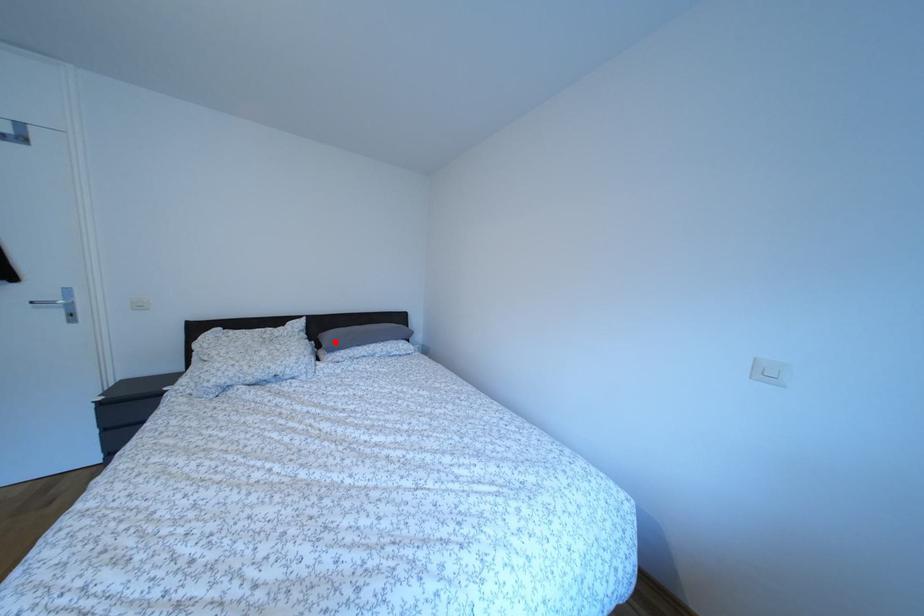
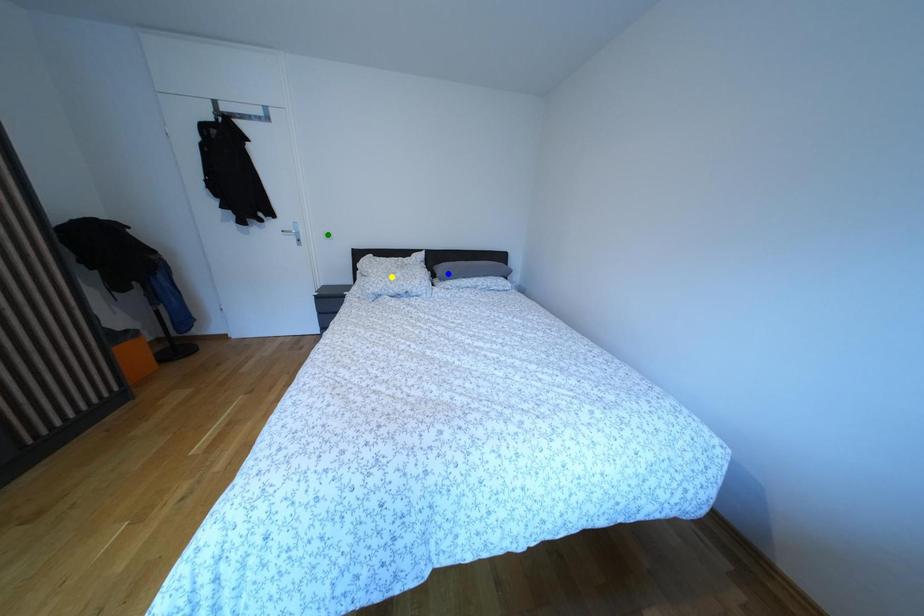
Question: I am providing you with two images of the same scene from different viewpoints. A red point is marked on the first image. You are given multiple points on the second image. In image 2, which mark is for the same physical point as the one in image 1?

Choices:
 (A) green point
 (B) blue point
 (C) yellow point

Answer: (B)